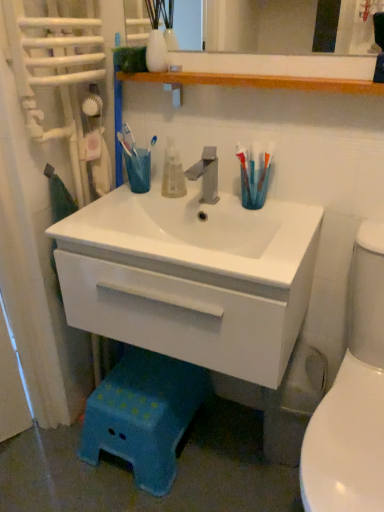
The height and width of the screenshot is (512, 384). What do you see at coordinates (254, 174) in the screenshot?
I see `translucent plastic toothbrush at right` at bounding box center [254, 174].

At what (x,y) coordinates should I click in order to perform the action: click on satin nickel faucet at center. Please return your answer as a coordinate pair (x, y). This screenshot has height=512, width=384. Looking at the image, I should click on (206, 174).

This screenshot has width=384, height=512. Describe the element at coordinates (206, 174) in the screenshot. I see `satin nickel faucet at center` at that location.

Locate an element on the screen. The height and width of the screenshot is (512, 384). translucent plastic mouthwash at center is located at coordinates (173, 172).

This screenshot has height=512, width=384. Describe the element at coordinates (256, 82) in the screenshot. I see `wooden shelf at upper center` at that location.

You are a GUI agent. You are given a task and a screenshot of the screen. Output one action in this format:
    pyautogui.click(x=<x>, y=<y>)
    Task: Click on the white glossy toilet at right
    
    Given the screenshot: What is the action you would take?
    pyautogui.click(x=352, y=398)

What do you see at coordinates (144, 415) in the screenshot? I see `blue plastic step stool at lower center` at bounding box center [144, 415].

Find the location of a particular element. This screenshot has height=512, width=384. translucent plastic toothbrush at right is located at coordinates (254, 174).

Does translucent plastic mouthwash at center have a smaller size compared to translucent plastic toothbrush at right?

No.

Does translucent plastic mouthwash at center have a greater height compared to translucent plastic toothbrush at right?

Incorrect, the height of translucent plastic mouthwash at center is not larger of that of translucent plastic toothbrush at right.

Is translucent plastic mouthwash at center not within translucent plastic toothbrush at right?

Indeed, translucent plastic mouthwash at center is completely outside translucent plastic toothbrush at right.

Looking at this image, is translucent plastic mouthwash at center turned away from translucent plastic toothbrush at right?

That's not correct — translucent plastic mouthwash at center is not looking away from translucent plastic toothbrush at right.

In terms of size, does wooden shelf at upper center appear bigger or smaller than white glossy cabinet at center?

Considering their sizes, wooden shelf at upper center takes up less space than white glossy cabinet at center.

Is wooden shelf at upper center next to white glossy cabinet at center?

No, wooden shelf at upper center is not next to white glossy cabinet at center.

Who is more distant, wooden shelf at upper center or white glossy cabinet at center?

wooden shelf at upper center is more distant.

Based on the photo, considering the relative sizes of wooden shelf at upper center and white glossy cabinet at center in the image provided, is wooden shelf at upper center taller than white glossy cabinet at center?

Incorrect, the height of wooden shelf at upper center is not larger of that of white glossy cabinet at center.

Is satin nickel faucet at center surrounded by translucent plastic toothbrush at right?

No, satin nickel faucet at center is not a part of translucent plastic toothbrush at right.

Is satin nickel faucet at center at the back of translucent plastic toothbrush at right?

No, translucent plastic toothbrush at right's orientation is not away from satin nickel faucet at center.

Considering the positions of point (270, 158) and point (207, 182), is point (270, 158) closer or farther from the camera than point (207, 182)?

Clearly, point (270, 158) is closer to the camera than point (207, 182).

From the picture: Does translucent plastic toothbrush at right touch satin nickel faucet at center?

No.

Is the position of satin nickel faucet at center less distant than that of white glossy cabinet at center?

That is False.

Is white glossy cabinet at center at the back of satin nickel faucet at center?

No.

From the image's perspective, is satin nickel faucet at center under white glossy cabinet at center?

Actually, satin nickel faucet at center appears above white glossy cabinet at center in the image.

Is translucent plastic toothbrush at right smaller than white glossy toilet at right?

Yes, translucent plastic toothbrush at right is smaller than white glossy toilet at right.

Is translucent plastic toothbrush at right spatially inside white glossy toilet at right, or outside of it?

translucent plastic toothbrush at right is outside white glossy toilet at right.

Does point (266, 178) come in front of point (344, 364)?

No, it is behind (344, 364).

Considering the relative positions of translucent plastic toothbrush at right and white glossy toilet at right in the image provided, is translucent plastic toothbrush at right to the left or to the right of white glossy toilet at right?

translucent plastic toothbrush at right is positioned on white glossy toilet at right's left side.

Is translucent plastic mouthwash at center beside white glossy cabinet at center?

They are not placed beside each other.

Considering the positions of objects translucent plastic mouthwash at center and white glossy cabinet at center in the image provided, who is more to the left, translucent plastic mouthwash at center or white glossy cabinet at center?

From the viewer's perspective, translucent plastic mouthwash at center appears more on the left side.

Considering their positions, is translucent plastic mouthwash at center located in front of or behind white glossy cabinet at center?

Clearly, translucent plastic mouthwash at center is behind white glossy cabinet at center.

Is translucent plastic mouthwash at center looking in the opposite direction of white glossy cabinet at center?

translucent plastic mouthwash at center does not have its back to white glossy cabinet at center.

Does satin nickel faucet at center turn towards blue plastic step stool at lower center?

No, satin nickel faucet at center is not oriented towards blue plastic step stool at lower center.

Considering the relative positions of satin nickel faucet at center and blue plastic step stool at lower center in the image provided, is satin nickel faucet at center behind blue plastic step stool at lower center?

No, it is in front of blue plastic step stool at lower center.

Find the location of a particular element. mouthwash below the translucent plastic toothbrush at right (from a real-world perspective) is located at coordinates (173, 172).

I want to click on bathroom cabinet below the wooden shelf at upper center (from the image's perspective), so click(191, 277).

Looking at the image, which one is located closer to wooden shelf at upper center, satin nickel faucet at center or translucent plastic mouthwash at center?

satin nickel faucet at center is closer to wooden shelf at upper center.

Based on their spatial positions, is translucent plastic mouthwash at center or white glossy toilet at right closer to wooden shelf at upper center?

Based on the image, translucent plastic mouthwash at center appears to be nearer to wooden shelf at upper center.

Based on their spatial positions, is satin nickel faucet at center or translucent plastic toothbrush at right closer to white glossy cabinet at center?

The object closer to white glossy cabinet at center is satin nickel faucet at center.

Looking at this image, when comparing their distances from white glossy toilet at right, does satin nickel faucet at center or white glossy cabinet at center seem further?

satin nickel faucet at center lies further to white glossy toilet at right than the other object.

When comparing their distances from translucent plastic toothbrush at right, does satin nickel faucet at center or white glossy cabinet at center seem closer?

Among the two, satin nickel faucet at center is located nearer to translucent plastic toothbrush at right.

Which object lies further to the anchor point white glossy cabinet at center, translucent plastic mouthwash at center or blue plastic step stool at lower center?

blue plastic step stool at lower center is further to white glossy cabinet at center.

Based on their spatial positions, is white glossy toilet at right or wooden shelf at upper center closer to translucent plastic toothbrush at right?

wooden shelf at upper center is positioned closer to the anchor translucent plastic toothbrush at right.

From the image, which object appears to be farther from translucent plastic toothbrush at right, white glossy cabinet at center or wooden shelf at upper center?

white glossy cabinet at center.

Identify the location of tap between translucent plastic toothbrush at right and white glossy cabinet at center vertically. (206, 174).

At what (x,y) coordinates should I click in order to perform the action: click on tap between wooden shelf at upper center and white glossy toilet at right from top to bottom. Please return your answer as a coordinate pair (x, y). Image resolution: width=384 pixels, height=512 pixels. Looking at the image, I should click on (206, 174).

You are a GUI agent. You are given a task and a screenshot of the screen. Output one action in this format:
    pyautogui.click(x=<x>, y=<y>)
    Task: Click on the bathroom cabinet between satin nickel faucet at center and white glossy toilet at right in the up-down direction
    This screenshot has width=384, height=512.
    Given the screenshot: What is the action you would take?
    pyautogui.click(x=191, y=277)

The height and width of the screenshot is (512, 384). What are the coordinates of `mouthwash that lies between wooden shelf at upper center and white glossy cabinet at center from top to bottom` in the screenshot? It's located at (173, 172).